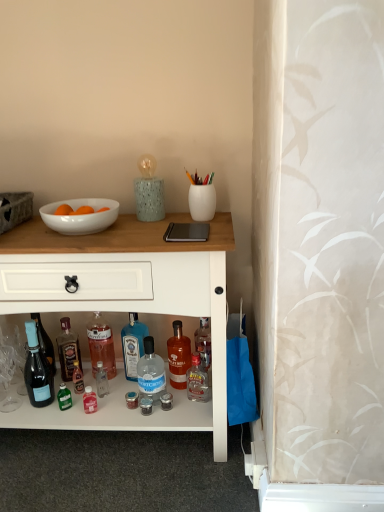
I want to click on space that is in front of white glossy bowl at upper left, so click(x=73, y=243).